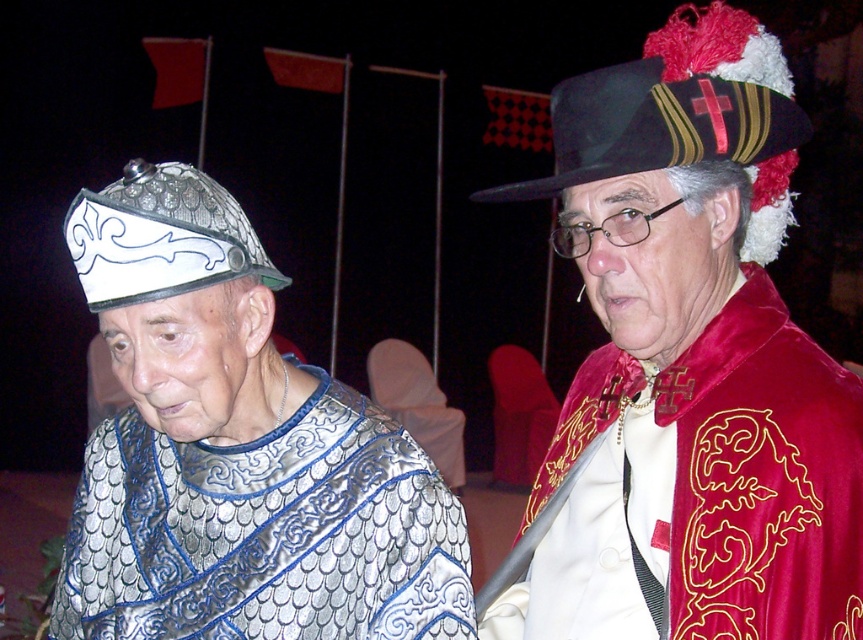
Question: Does velvet red cape at upper right have a larger size compared to metallic chainmail at left?

Choices:
 (A) no
 (B) yes

Answer: (B)

Question: Which object appears closest to the camera in this image?

Choices:
 (A) white metallic helmet at left
 (B) velvet red cape at upper right

Answer: (B)

Question: Is metallic chainmail at left above white metallic helmet at left?

Choices:
 (A) no
 (B) yes

Answer: (A)

Question: Which object is the farthest from the metallic chainmail at left?

Choices:
 (A) white metallic helmet at left
 (B) black felt hat at upper right

Answer: (B)

Question: Which point is farther to the camera?

Choices:
 (A) (526, 193)
 (B) (224, 244)
 (C) (568, 438)

Answer: (C)

Question: Can you confirm if metallic chainmail at left is positioned to the left of black felt hat at upper right?

Choices:
 (A) yes
 (B) no

Answer: (A)